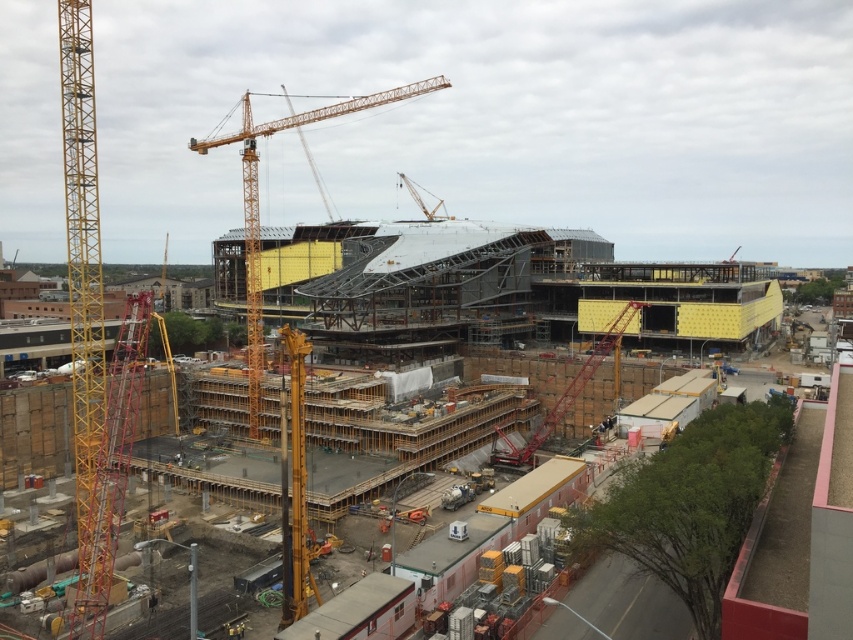
You are an engineer observing the construction site. You need to determine the spatial relationship between the yellow wood construction site at center and the yellow metallic crane at upper left. Based on the scene, which object is positioned higher?

The yellow metallic crane at upper left is positioned higher than the yellow wood construction site at center.

You are a delivery truck driver arriving at the construction site. You need to unload heavy materials at the yellow wood construction site at center. However, your truck has a height restriction of 4 meters. Can you safely pass under the yellow metallic crane at left without hitting it?

The yellow wood construction site at center is larger than the yellow metallic crane at left, but the height of the crane is not specified in the description. Therefore, it is uncertain whether the truck can safely pass under the yellow metallic crane at left without hitting it.

Based on the photo, you are a construction worker standing at the camera position. You need to deliver a heavy tool to the yellow wood construction site at center. If the maximum distance you can carry the tool is 85 meters, will you be able to reach the site without needing assistance?

The yellow wood construction site at center and camera are 86.06 meters apart, which exceeds the maximum distance of 85 meters you can carry the tool. Therefore, you will need assistance to reach the site.